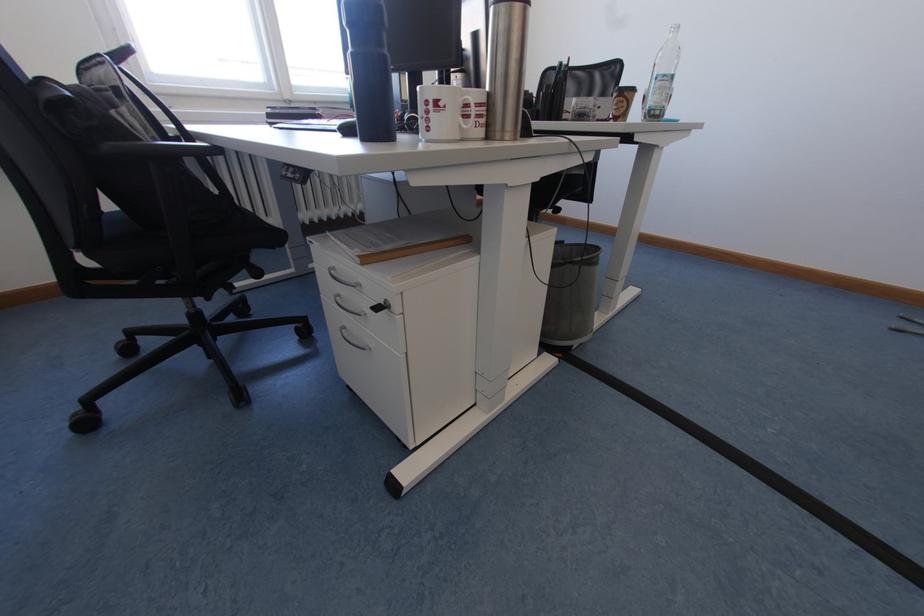
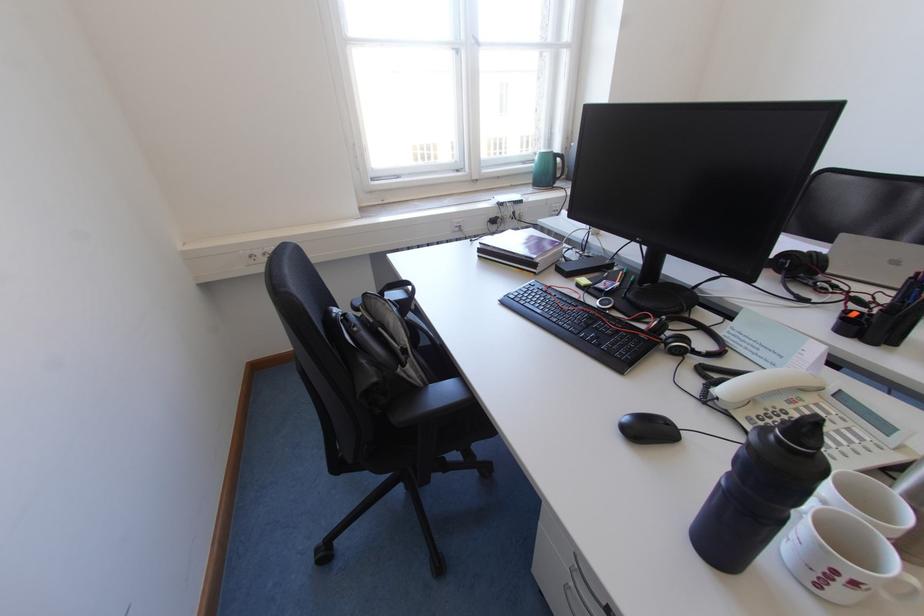
Find the pixel in the second image that matches (x=95, y=424) in the first image.

(333, 556)